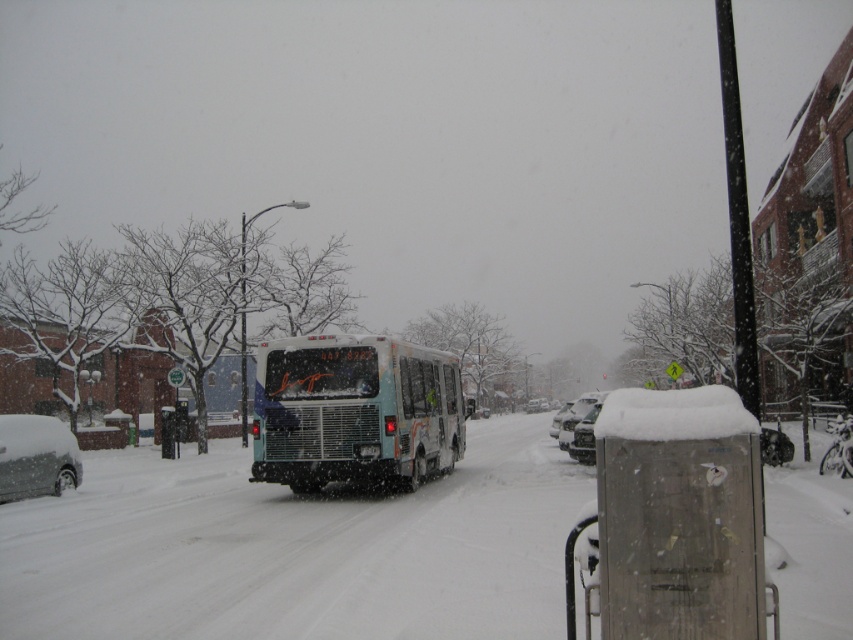
Which is below, white matte bus at center or snow-covered sedan at center?

snow-covered sedan at center

Is white matte bus at center further to the viewer compared to snow-covered sedan at center?

That is False.

Measure the distance between point (288, 458) and camera.

Point (288, 458) and camera are 51.57 feet apart from each other.

The width and height of the screenshot is (853, 640). I want to click on white matte bus at center, so click(355, 412).

Is matte black van at lower left below snow-covered sedan at center?

Actually, matte black van at lower left is above snow-covered sedan at center.

Who is shorter, matte black van at lower left or snow-covered sedan at center?

matte black van at lower left

Between point (24, 461) and point (577, 445), which one is positioned in front?

Point (24, 461) is more forward.

At what (x,y) coordinates should I click in order to perform the action: click on matte black van at lower left. Please return your answer as a coordinate pair (x, y). This screenshot has height=640, width=853. Looking at the image, I should click on (36, 456).

Image resolution: width=853 pixels, height=640 pixels. What do you see at coordinates (355, 412) in the screenshot? I see `white matte bus at center` at bounding box center [355, 412].

Who is more forward, (358, 476) or (27, 496)?

Positioned in front is point (358, 476).

The width and height of the screenshot is (853, 640). I want to click on white matte bus at center, so click(x=355, y=412).